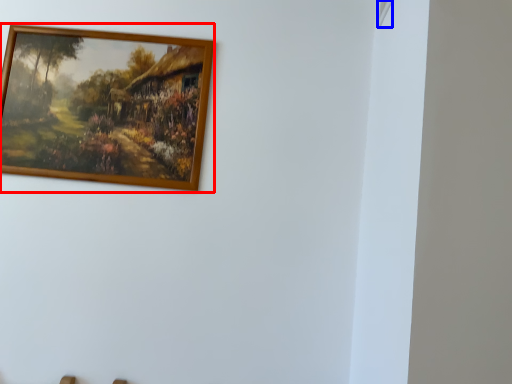
Question: Which object appears closest to the camera in this image, picture frame (highlighted by a red box) or window (highlighted by a blue box)?

Choices:
 (A) picture frame
 (B) window

Answer: (B)